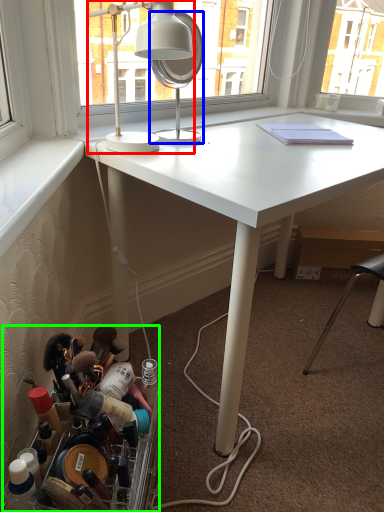
Question: Which object is the closest to the lamp (highlighted by a red box)? Choose among these: mirror (highlighted by a blue box) or toiletry (highlighted by a green box).

Choices:
 (A) mirror
 (B) toiletry

Answer: (A)